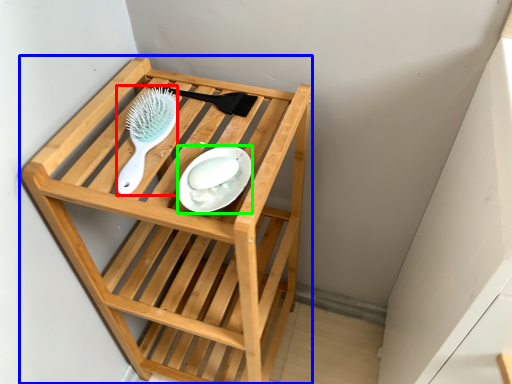
Question: Based on their relative distances, which object is nearer to brush (highlighted by a red box)? Choose from furniture (highlighted by a blue box) and plate (highlighted by a green box).

Choices:
 (A) furniture
 (B) plate

Answer: (B)